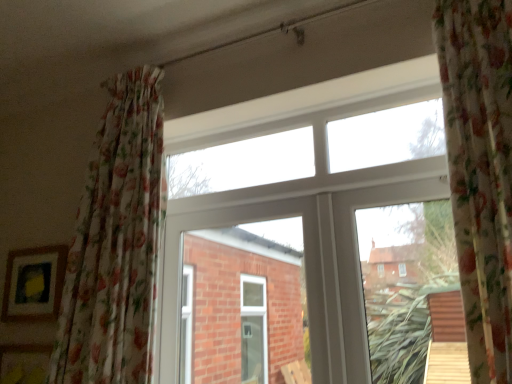
Question: Does white plastic window at center lie behind floral fabric curtain at left?

Choices:
 (A) yes
 (B) no

Answer: (A)

Question: Can you confirm if white plastic window at center is shorter than floral fabric curtain at left?

Choices:
 (A) no
 (B) yes

Answer: (B)

Question: Is white plastic window at center aimed at floral fabric curtain at left?

Choices:
 (A) yes
 (B) no

Answer: (A)

Question: From the image's perspective, is white plastic window at center on top of floral fabric curtain at left?

Choices:
 (A) no
 (B) yes

Answer: (A)

Question: From a real-world perspective, is white plastic window at center physically above floral fabric curtain at left?

Choices:
 (A) yes
 (B) no

Answer: (B)

Question: Is floral fabric curtain at left completely or partially inside white plastic window at center?

Choices:
 (A) no
 (B) yes

Answer: (A)

Question: Does white plastic window at center appear on the left side of matte wooden picture frame at lower left?

Choices:
 (A) no
 (B) yes

Answer: (A)

Question: Are white plastic window at center and matte wooden picture frame at lower left located far from each other?

Choices:
 (A) yes
 (B) no

Answer: (B)

Question: Is white plastic window at center positioned in front of matte wooden picture frame at lower left?

Choices:
 (A) no
 (B) yes

Answer: (B)

Question: Does white plastic window at center have a smaller size compared to matte wooden picture frame at lower left?

Choices:
 (A) yes
 (B) no

Answer: (B)

Question: Is white plastic window at center wider than matte wooden picture frame at lower left?

Choices:
 (A) yes
 (B) no

Answer: (A)

Question: Is white plastic window at center turned away from matte wooden picture frame at lower left?

Choices:
 (A) yes
 (B) no

Answer: (B)

Question: Is floral fabric curtain at left wider than white plastic window at center?

Choices:
 (A) no
 (B) yes

Answer: (B)